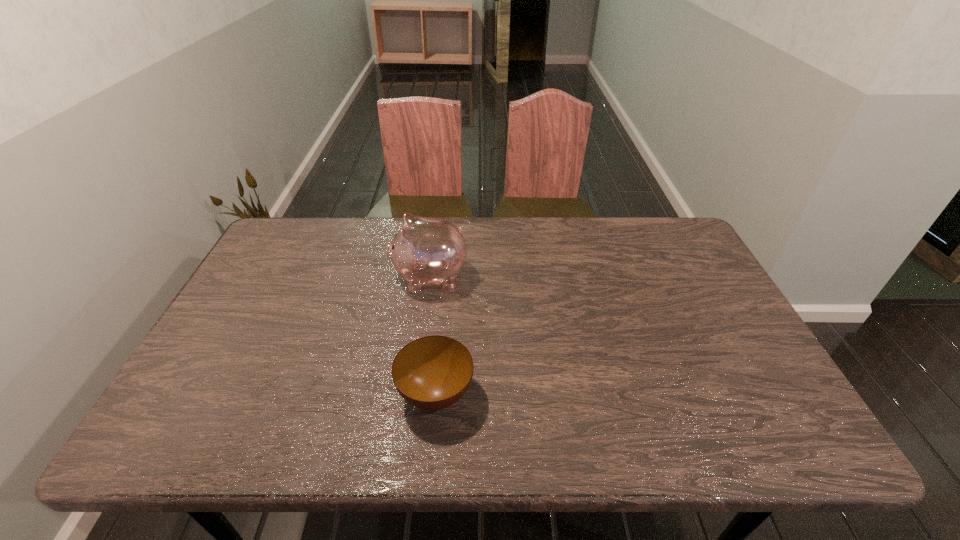
You are a GUI agent. You are given a task and a screenshot of the screen. Output one action in this format:
    pyautogui.click(x=<x>, y=<y>)
    Task: Click on the piggy bank
    Image resolution: width=960 pixels, height=540 pixels.
    Given the screenshot: What is the action you would take?
    pyautogui.click(x=426, y=251)

Identify the location of the taller object. (426, 251).

Identify the location of the shorter object. (431, 373).

Identify the location of the nearer object. This screenshot has height=540, width=960. (431, 373).

Identify the location of free spot located 0.270m on the front facing side of the piggy bank. The height and width of the screenshot is (540, 960). (301, 278).

This screenshot has width=960, height=540. What are the coordinates of `free space located 0.140m on the front facing side of the piggy bank` in the screenshot? It's located at (345, 278).

Image resolution: width=960 pixels, height=540 pixels. In order to click on vacant point located on the front facing side of the piggy bank in this screenshot , I will do `click(338, 278)`.

At what (x,y) coordinates should I click in order to perform the action: click on vacant position located 0.080m on the right of the shorter object. Please return your answer as a coordinate pair (x, y). Looking at the image, I should click on (509, 394).

Identify the location of object that is at the far edge. This screenshot has width=960, height=540. (426, 251).

Find the location of a particular element. This screenshot has width=960, height=540. object positioned at the near edge is located at coordinates (431, 373).